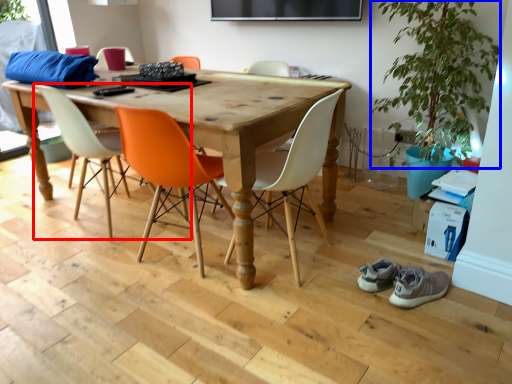
Question: Which object is closer to the camera taking this photo, chair (highlighted by a red box) or plant (highlighted by a blue box)?

Choices:
 (A) chair
 (B) plant

Answer: (B)